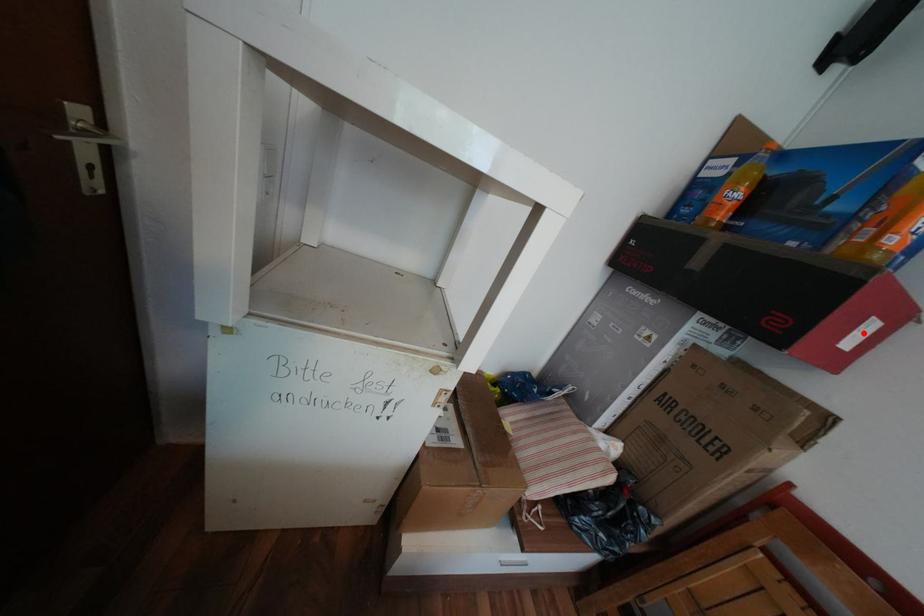
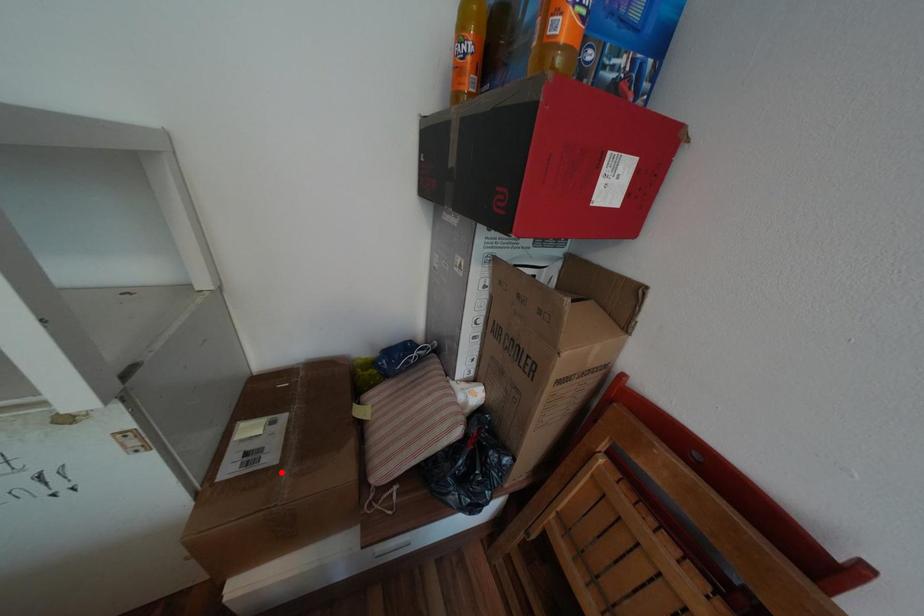
I am providing you with two images of the same scene from different viewpoints. A red point is marked on the first image and another point is marked on the second image. Do the highlighted points in image1 and image2 indicate the same real-world spot?

No